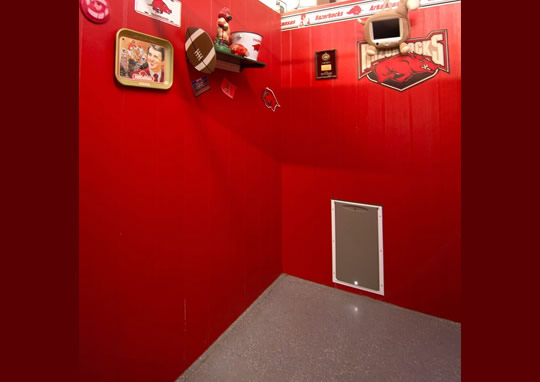
This screenshot has width=540, height=382. I want to click on the bottom side of shelf, so click(232, 58).